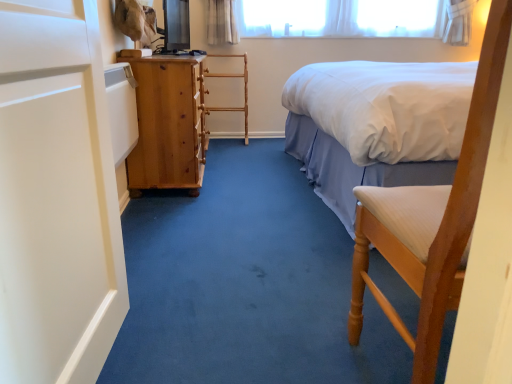
Question: Is wooden chair at right directly adjacent to wooden rack at center?

Choices:
 (A) yes
 (B) no

Answer: (B)

Question: Is wooden chair at right located outside wooden rack at center?

Choices:
 (A) yes
 (B) no

Answer: (A)

Question: Is wooden chair at right positioned far away from wooden rack at center?

Choices:
 (A) no
 (B) yes

Answer: (B)

Question: Is wooden chair at right to the right of wooden rack at center from the viewer's perspective?

Choices:
 (A) yes
 (B) no

Answer: (A)

Question: Is the position of wooden chair at right more distant than that of wooden rack at center?

Choices:
 (A) no
 (B) yes

Answer: (A)

Question: Is wooden rack at center inside wooden chair at right?

Choices:
 (A) yes
 (B) no

Answer: (B)

Question: Is white cotton bed at upper right positioned with its back to wooden chair at right?

Choices:
 (A) no
 (B) yes

Answer: (A)

Question: Is white cotton bed at upper right outside wooden chair at right?

Choices:
 (A) yes
 (B) no

Answer: (A)

Question: Can wooden chair at right be found inside white cotton bed at upper right?

Choices:
 (A) no
 (B) yes

Answer: (A)

Question: Is white cotton bed at upper right further to camera compared to wooden chair at right?

Choices:
 (A) no
 (B) yes

Answer: (B)

Question: Considering the relative sizes of white cotton bed at upper right and wooden chair at right in the image provided, is white cotton bed at upper right shorter than wooden chair at right?

Choices:
 (A) yes
 (B) no

Answer: (B)

Question: Is the depth of white cotton bed at upper right less than that of wooden chair at right?

Choices:
 (A) yes
 (B) no

Answer: (B)

Question: Considering the relative sizes of wooden rack at center and wooden chair at right in the image provided, is wooden rack at center wider than wooden chair at right?

Choices:
 (A) no
 (B) yes

Answer: (A)